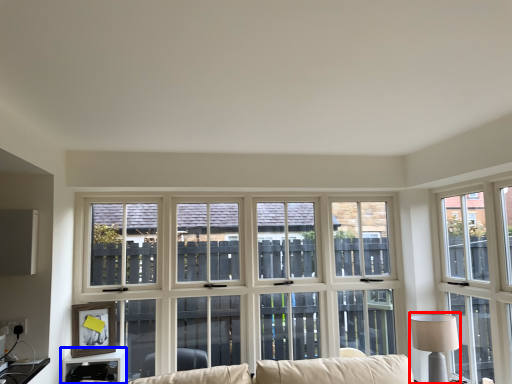
Question: Which of the following is the farthest to the observer, table lamp (highlighted by a red box) or table (highlighted by a blue box)?

Choices:
 (A) table lamp
 (B) table

Answer: (A)